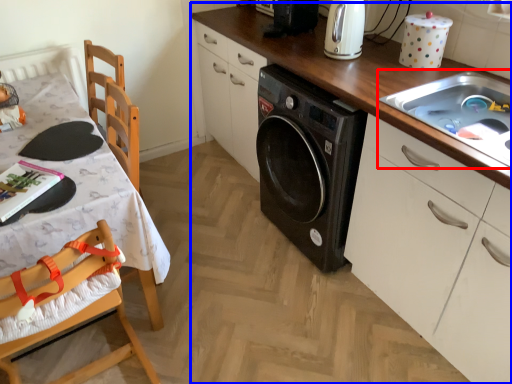
Question: Among these objects, which one is farthest to the camera, sink (highlighted by a red box) or countertop (highlighted by a blue box)?

Choices:
 (A) sink
 (B) countertop

Answer: (A)